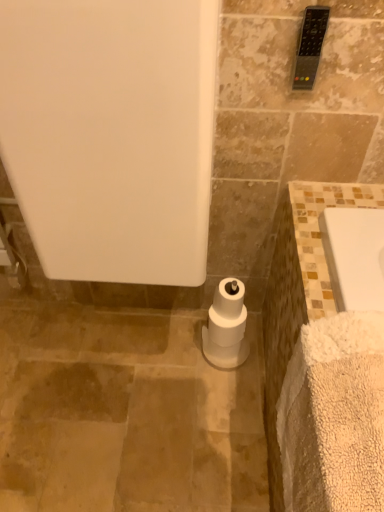
Question: Would you say white fluffy bath towel at lower right is a long distance from white matte toilet paper at center?

Choices:
 (A) yes
 (B) no

Answer: (B)

Question: From the image's perspective, is white fluffy bath towel at lower right below white matte toilet paper at center?

Choices:
 (A) no
 (B) yes

Answer: (B)

Question: Is white fluffy bath towel at lower right to the left of white matte toilet paper at center from the viewer's perspective?

Choices:
 (A) no
 (B) yes

Answer: (A)

Question: Is the depth of white fluffy bath towel at lower right less than that of white matte toilet paper at center?

Choices:
 (A) yes
 (B) no

Answer: (A)

Question: Is white fluffy bath towel at lower right taller than white matte toilet paper at center?

Choices:
 (A) no
 (B) yes

Answer: (B)

Question: Would you say white fluffy bath towel at lower right is to the left or to the right of white matte bathtub at center in the picture?

Choices:
 (A) right
 (B) left

Answer: (A)

Question: Is point (314, 465) positioned closer to the camera than point (107, 237)?

Choices:
 (A) closer
 (B) farther

Answer: (A)

Question: Do you think white fluffy bath towel at lower right is within white matte bathtub at center, or outside of it?

Choices:
 (A) outside
 (B) inside

Answer: (A)

Question: Looking at their shapes, would you say white fluffy bath towel at lower right is wider or thinner than white matte bathtub at center?

Choices:
 (A) thin
 (B) wide

Answer: (A)

Question: In the image, is white matte toilet paper at center on the left side or the right side of white matte bathtub at center?

Choices:
 (A) right
 (B) left

Answer: (A)

Question: Is point (236, 313) positioned closer to the camera than point (56, 162)?

Choices:
 (A) closer
 (B) farther

Answer: (B)

Question: From the image's perspective, is white matte toilet paper at center above or below white matte bathtub at center?

Choices:
 (A) below
 (B) above

Answer: (A)

Question: Is white matte toilet paper at center taller or shorter than white matte bathtub at center?

Choices:
 (A) short
 (B) tall

Answer: (A)

Question: Is white fluffy bath towel at lower right situated inside black plastic remote control at upper right or outside?

Choices:
 (A) inside
 (B) outside

Answer: (B)

Question: In the image, is white fluffy bath towel at lower right positioned in front of or behind black plastic remote control at upper right?

Choices:
 (A) front
 (B) behind

Answer: (A)